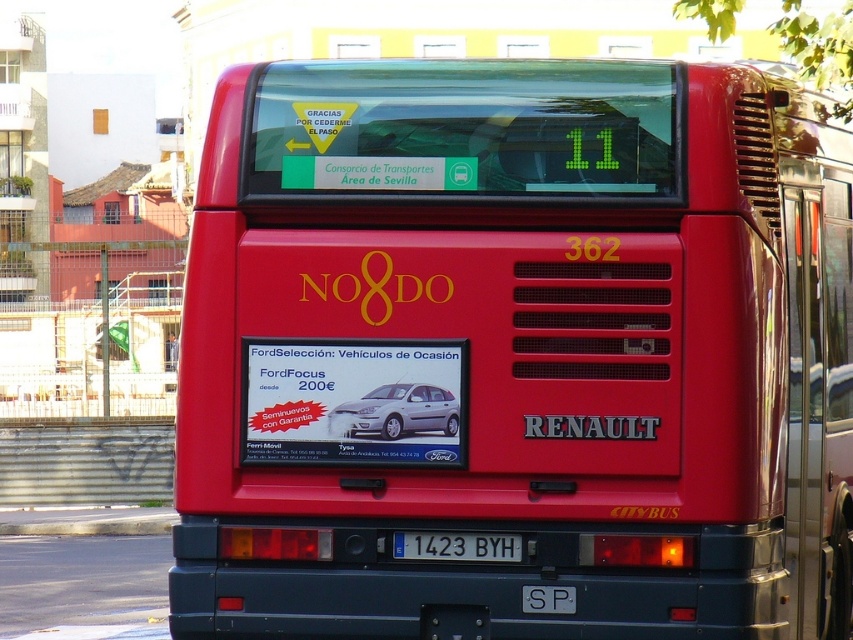
You are a delivery person who needs to park your van next to the shiny red bus at center and the satin silver metallic hatchback at center. Which vehicle should you park closer to if your van is narrower than the hatchback?

You should park closer to the satin silver metallic hatchback at center because the shiny red bus at center is wider than the satin silver metallic hatchback at center, so the hatchback takes up less space.

You are standing on the sidewalk and see the rear of the red bus with its advertisement. There are two points marked on the bus. Which point, point 1 at coordinates (670, 456) or point 2 at coordinates (438, 410), is closer to the front of the bus?

Point 1 at coordinates (670, 456) is closer to the front of the bus because it is in front of point 2 at coordinates (438, 410).

In the scene shown: You are standing on the sidewalk and see the shiny red bus at center and the metallic silver car at center. Which object is closer to you?

The shiny red bus at center is closer to you because it is positioned in front of the metallic silver car at center, making it appear nearer in the image.